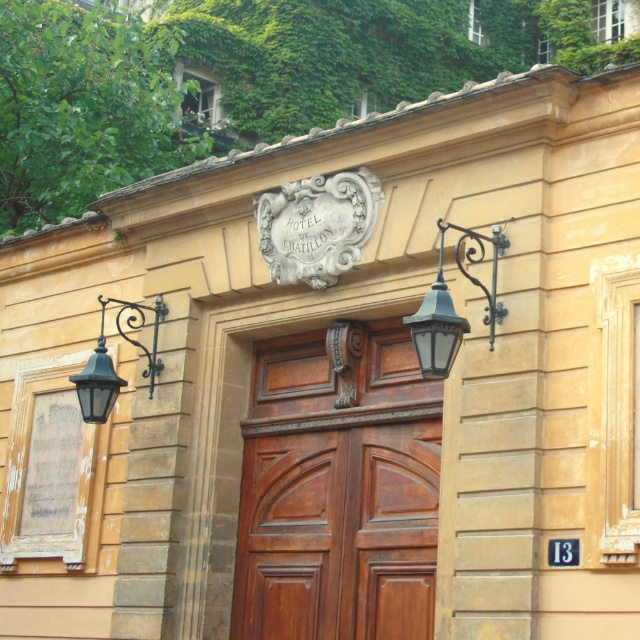
Does point (451, 337) come behind point (116, 392)?

No, it is in front of (116, 392).

This screenshot has width=640, height=640. Find the location of `matte black lantern at center right`. matte black lantern at center right is located at coordinates (452, 305).

Does polished wood door at center come in front of matte black lantern at center right?

No, it is behind matte black lantern at center right.

Locate an element on the screen. Image resolution: width=640 pixels, height=640 pixels. polished wood door at center is located at coordinates (339, 488).

Is polished wood door at center above matte black lantern at left?

Actually, polished wood door at center is below matte black lantern at left.

Which is more to the right, polished wood door at center or matte black lantern at left?

Positioned to the right is polished wood door at center.

Which is in front, point (381, 488) or point (100, 378)?

Positioned in front is point (381, 488).

Locate an element on the screen. The width and height of the screenshot is (640, 640). polished wood door at center is located at coordinates (339, 488).